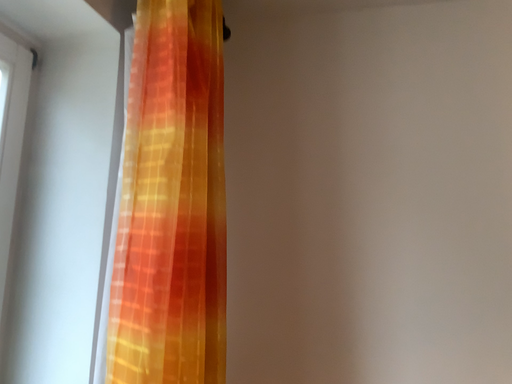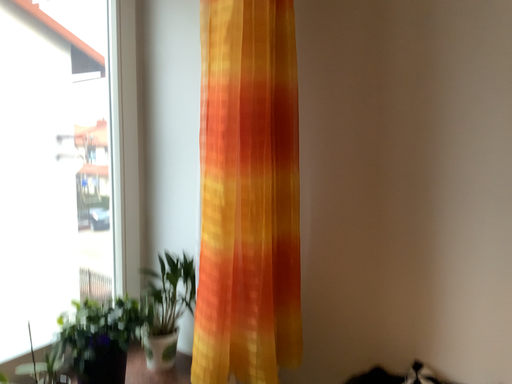
Question: Which way did the camera rotate in the video?

Choices:
 (A) rotated left
 (B) rotated right

Answer: (A)